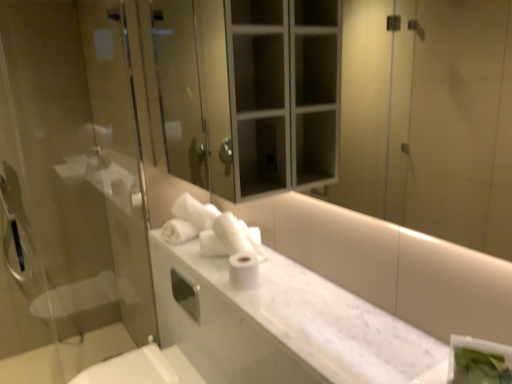
At what (x,y) coordinates should I click in order to perform the action: click on free space in front of white matte toilet paper at center. Please return your answer as a coordinate pair (x, y). Image resolution: width=512 pixels, height=384 pixels. Looking at the image, I should click on (252, 302).